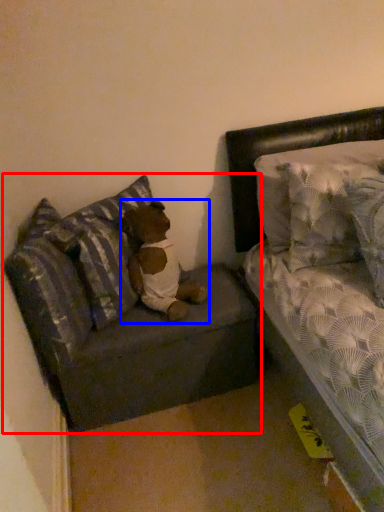
Question: Which of the following is the closest to the observer, studio couch (highlighted by a red box) or teddy (highlighted by a blue box)?

Choices:
 (A) studio couch
 (B) teddy

Answer: (B)